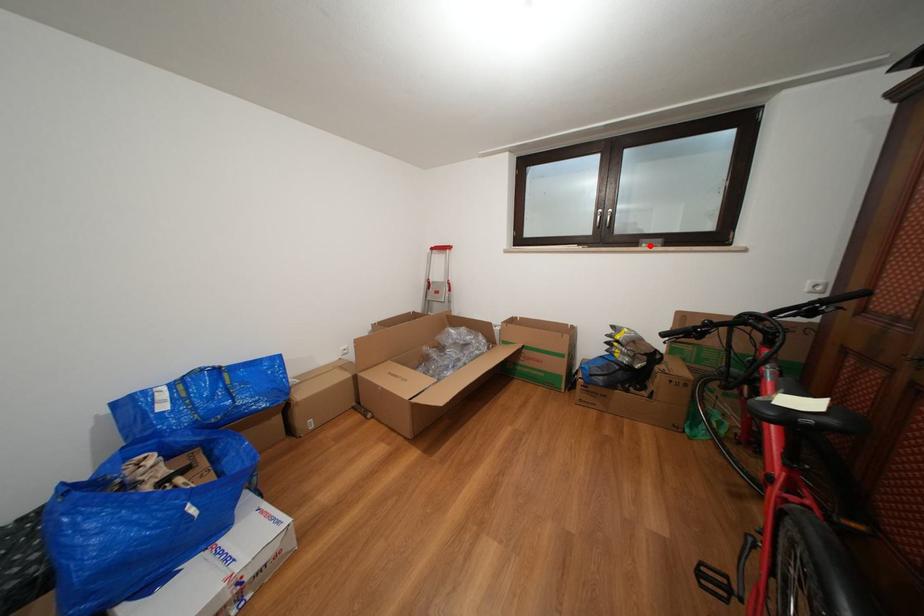
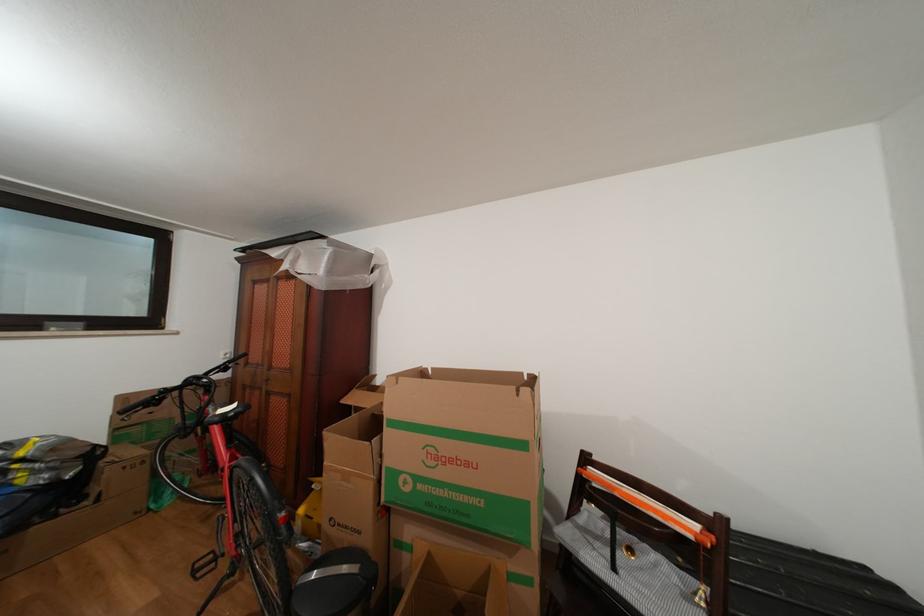
In the second image, find the point that corresponds to the highlighted location in the first image.

(56, 329)